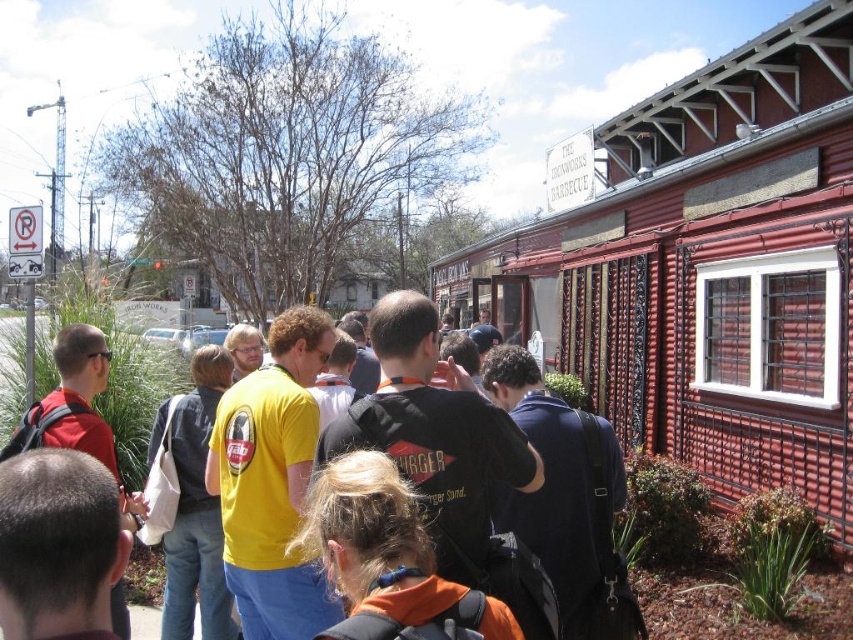
In the scene shown: Does black backpack at center appear under orange fabric backpack at center?

Actually, black backpack at center is above orange fabric backpack at center.

How far apart are black backpack at center and orange fabric backpack at center?

A distance of 47.86 centimeters exists between black backpack at center and orange fabric backpack at center.

Is point (434, 460) farther from viewer compared to point (370, 532)?

Yes, point (434, 460) is behind point (370, 532).

Locate an element on the screen. The width and height of the screenshot is (853, 640). black backpack at center is located at coordinates (439, 436).